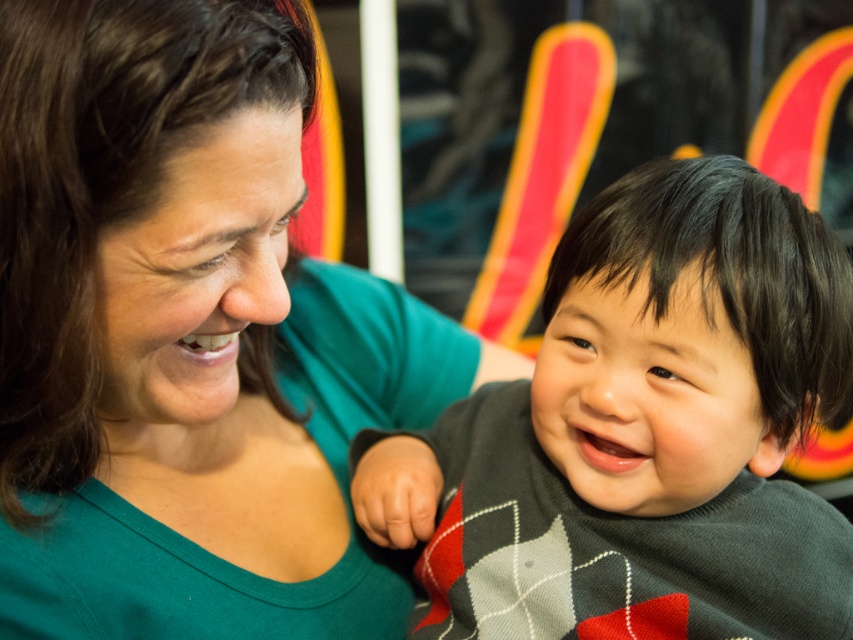
You are a photographer standing 2 meters away from the green matte shirt at center. You want to take a photo of both the woman and the child. Can you fit both of them in the frame without moving your position?

The woman and the child are 43.15 centimeters apart. Since you are 2 meters away, which is 200 centimeters, and the distance between them is much smaller than the camera sensor size, you can fit both in the frame without moving.

What are the coordinates of the green matte shirt at center?

The green matte shirt at center is located at coordinates (187, 336).